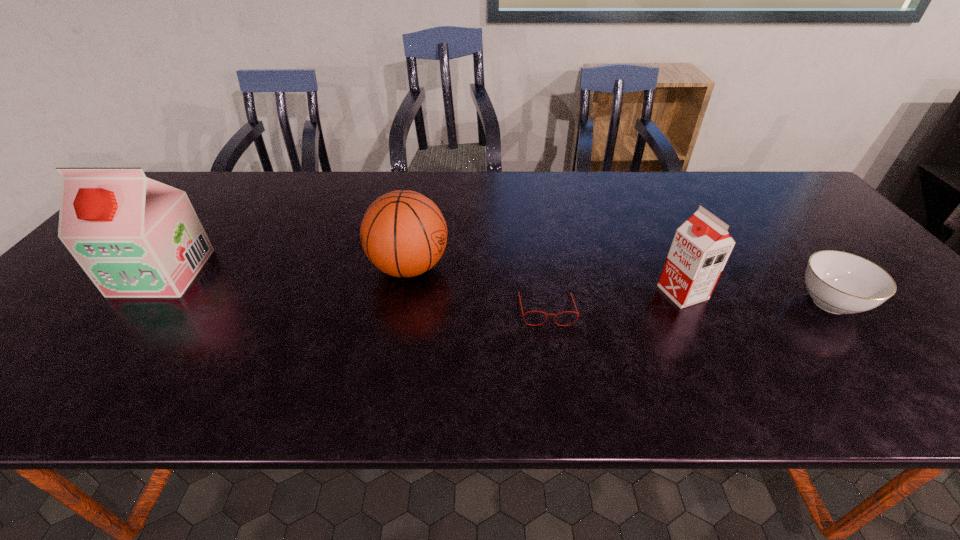
Find the location of `the taller soya milk`. the taller soya milk is located at coordinates (133, 236).

Locate an element on the screen. The width and height of the screenshot is (960, 540). the leftmost object is located at coordinates (133, 236).

The width and height of the screenshot is (960, 540). I want to click on the shorter soya milk, so click(x=701, y=246).

The height and width of the screenshot is (540, 960). In order to click on the right soya milk in this screenshot , I will do `click(701, 246)`.

Locate an element on the screen. the second object from left to right is located at coordinates (403, 233).

The image size is (960, 540). I want to click on chinaware, so click(x=838, y=282).

Locate an element on the screen. the fourth tallest object is located at coordinates (838, 282).

The height and width of the screenshot is (540, 960). Find the location of `the shortest object`. the shortest object is located at coordinates (577, 313).

Identify the location of the third object from left to right. Image resolution: width=960 pixels, height=540 pixels. (577, 313).

This screenshot has width=960, height=540. Find the location of `vacant region located 0.270m with the cap open on the left soya milk`. vacant region located 0.270m with the cap open on the left soya milk is located at coordinates (62, 397).